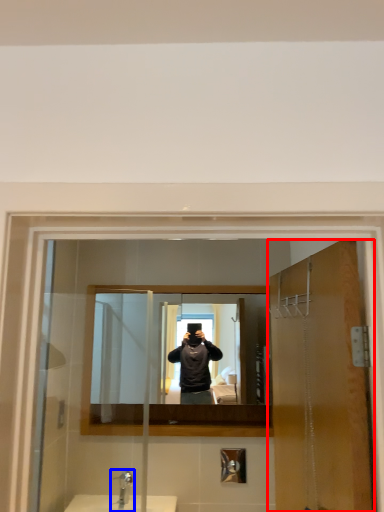
Question: Among these objects, which one is farthest to the camera, door (highlighted by a red box) or tap (highlighted by a blue box)?

Choices:
 (A) door
 (B) tap

Answer: (B)